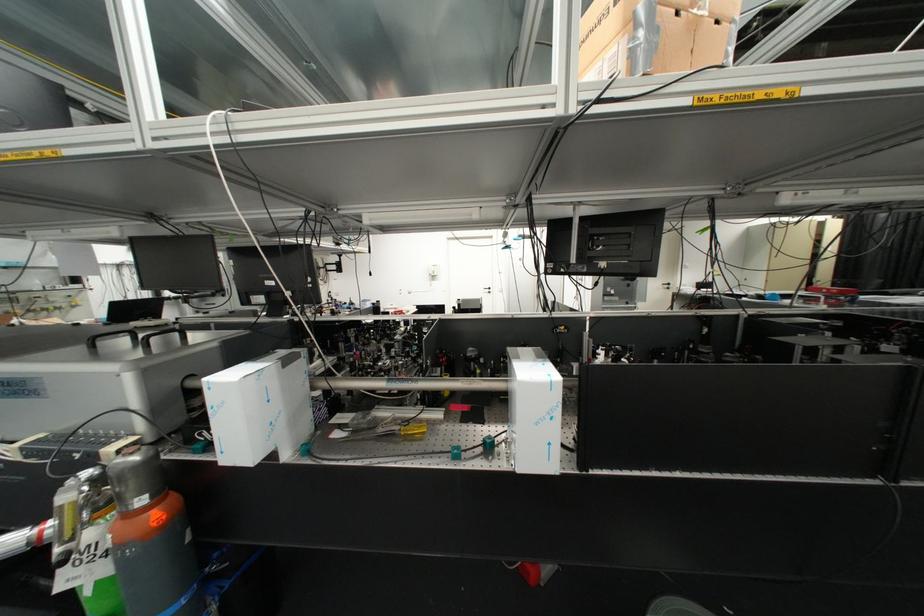
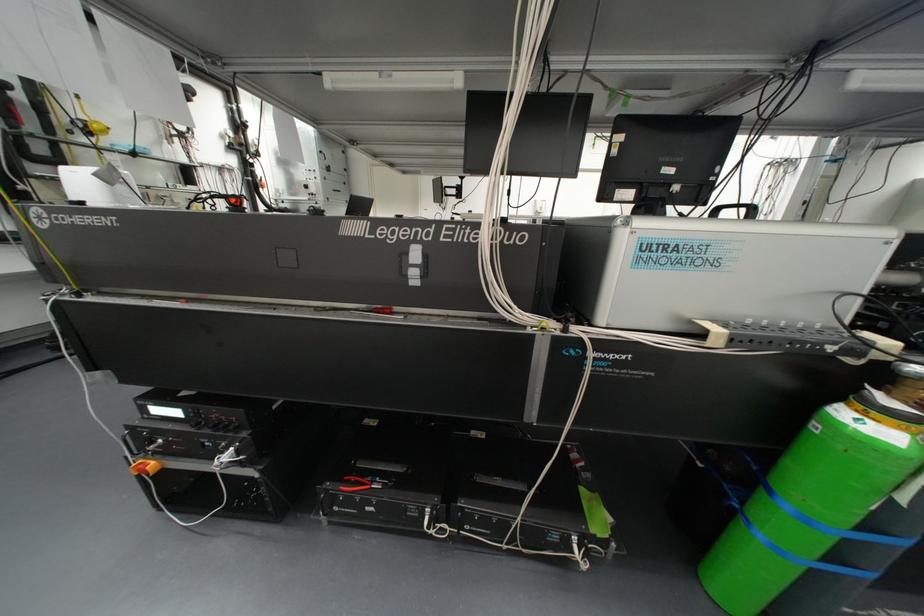
Question: What movement of the cameraman would produce the second image?

Choices:
 (A) Left
 (B) Right
 (C) Forward
 (D) Backward

Answer: (A)